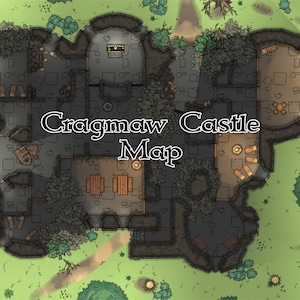
Where is `tables`? The height and width of the screenshot is (300, 300). tables is located at coordinates (92, 188), (123, 187).